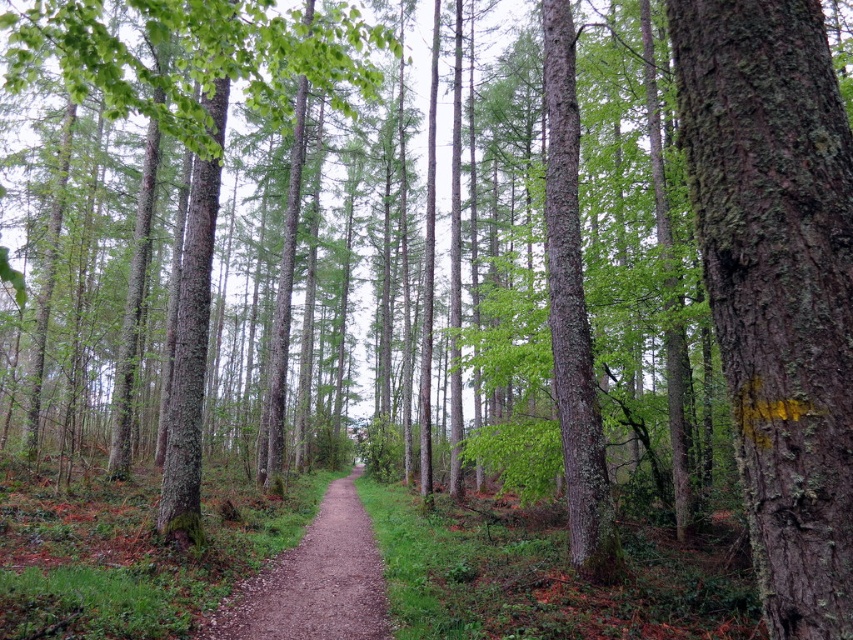
You are a hiker walking along the brown gravel path at center in the forest. You notice a smooth bark tree at center nearby. Which object takes up more space in the scene?

The smooth bark tree at center takes up more space in the scene than the brown gravel path at center, as it is described as bigger.

You are a hiker trying to follow the brown gravel path at center through the forest. There is a green mossy bark tree at right blocking part of the path. Can you walk around the tree without leaving the path?

The green mossy bark tree at right is thinner than the brown gravel path at center, so yes, you can walk around the tree without leaving the path since the path is wider than the tree.